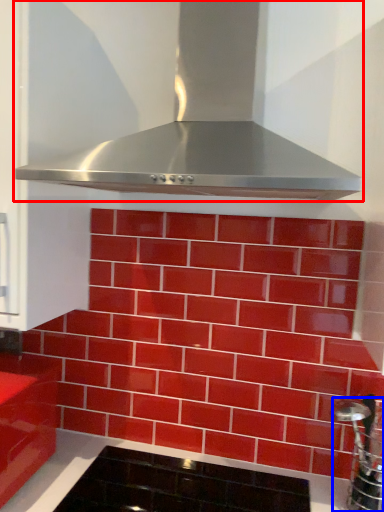
Question: Which object appears farthest to the camera in this image, home appliance (highlighted by a red box) or stainless steel (highlighted by a blue box)?

Choices:
 (A) home appliance
 (B) stainless steel

Answer: (B)